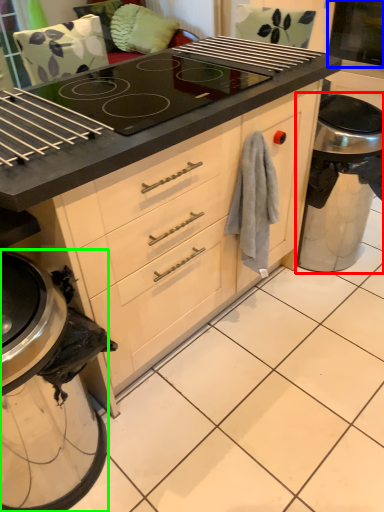
Question: Which object is positioned closest to appliance (highlighted by a red box)? Select from screen door (highlighted by a blue box) and kitchen appliance (highlighted by a green box).

Choices:
 (A) screen door
 (B) kitchen appliance

Answer: (A)